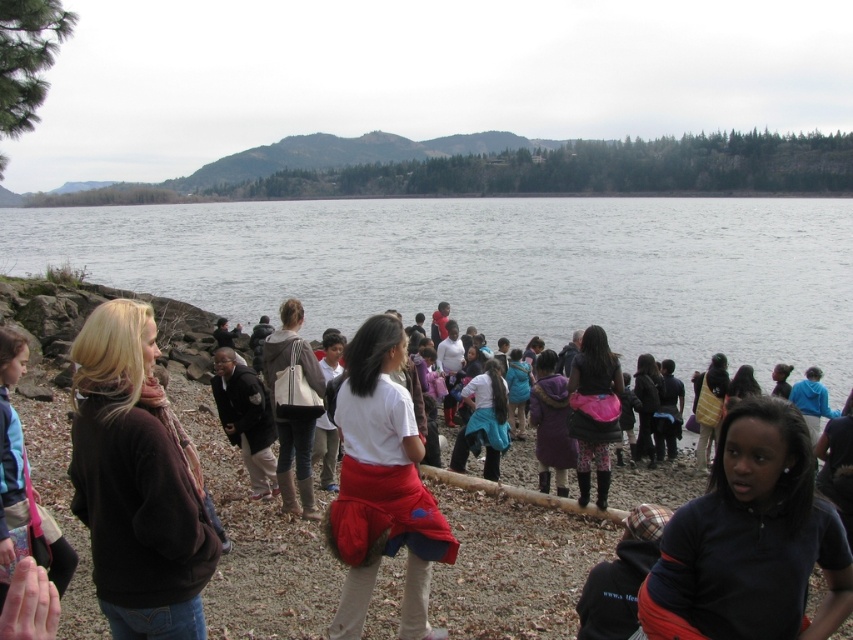
Question: Estimate the real-world distances between objects in this image. Which object is farther from the white cotton shirt at center?

Choices:
 (A) black matte shirt at lower right
 (B) matte beige handbag at center
 (C) matte white shirt at center
 (D) dark blue jacket at center

Answer: (C)

Question: Is dark brown sweater at left to the right of matte white shirt at center from the viewer's perspective?

Choices:
 (A) no
 (B) yes

Answer: (A)

Question: Does black matte shirt at lower right have a smaller size compared to dark purple fabric skirt at center?

Choices:
 (A) no
 (B) yes

Answer: (B)

Question: Is black matte shirt at lower right behind matte white shirt at center?

Choices:
 (A) yes
 (B) no

Answer: (B)

Question: Which object appears closest to the camera in this image?

Choices:
 (A) dark blue jacket at center
 (B) matte white shirt at center
 (C) dark purple fabric skirt at center

Answer: (C)

Question: Which of the following is the closest to the observer?

Choices:
 (A) gray water at center
 (B) dark brown sweater at left
 (C) matte white shirt at center

Answer: (B)